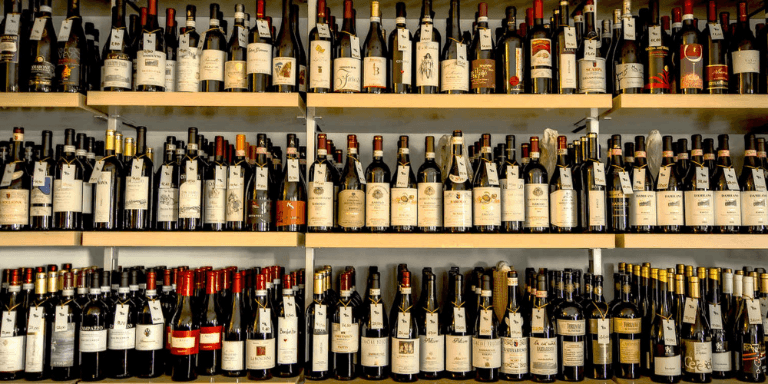
In order to click on wooden shelving in this screenshot , I will do `click(171, 92)`, `click(48, 100)`, `click(35, 238)`, `click(164, 236)`, `click(373, 240)`, `click(422, 100)`, `click(707, 100)`, `click(700, 244)`.